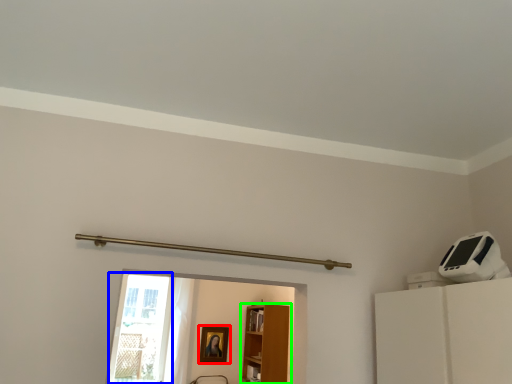
Question: Considering the real-world distances, which object is closest to picture frame (highlighted by a red box)? glass door (highlighted by a blue box) or furniture (highlighted by a green box).

Choices:
 (A) glass door
 (B) furniture

Answer: (B)